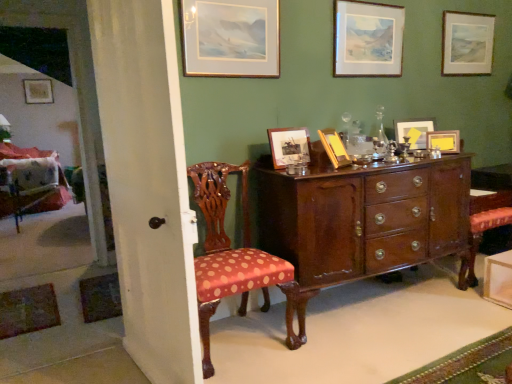
You are a GUI agent. You are given a task and a screenshot of the screen. Output one action in this format:
    pyautogui.click(x=<x>, y=<y>)
    Task: Click on the wooden picture frame at center, arranged as the seventh picture frame when viewed from the back
    The image size is (512, 384).
    Given the screenshot: What is the action you would take?
    pyautogui.click(x=334, y=148)

Measure the distance between point [336,136] and camera.

A distance of 2.44 meters exists between point [336,136] and camera.

Where is `polished wood cabinet at center`? This screenshot has width=512, height=384. polished wood cabinet at center is located at coordinates (362, 224).

What do you see at coordinates (38, 91) in the screenshot? Image resolution: width=512 pixels, height=384 pixels. I see `matte gold picture frame at upper left, the 1th picture frame positioned from the left` at bounding box center [38, 91].

This screenshot has height=384, width=512. In order to click on wooden picture frame at center, positioned as the 3th picture frame in front-to-back order in this screenshot , I will do `click(289, 146)`.

The height and width of the screenshot is (384, 512). I want to click on matte gold picture frame at upper center, acting as the 8th picture frame starting from the back, so click(x=230, y=38).

Image resolution: width=512 pixels, height=384 pixels. Describe the element at coordinates (230, 38) in the screenshot. I see `matte gold picture frame at upper center, positioned as the 2th picture frame in left-to-right order` at that location.

What do you see at coordinates (31, 182) in the screenshot?
I see `polka dot fabric chair at left, placed as the 1th chair when sorted from left to right` at bounding box center [31, 182].

In order to face polka dot fabric chair at left, which is the 2th chair in front-to-back order, should I rotate leftwards or rightwards?

Turn left approximately 27.982 degrees to face it.

The image size is (512, 384). I want to click on wooden picture frame at center, arranged as the fifth picture frame when viewed from the right, so [x=334, y=148].

Between matte gold picture frame at upper center, marked as the first picture frame in a front-to-back arrangement, and matte gold picture frame at upper left, which ranks as the 1th picture frame in back-to-front order, which one has more height?

With more height is matte gold picture frame at upper left, which ranks as the 1th picture frame in back-to-front order.

From a real-world perspective, which picture frame is the 3rd one underneath the matte gold picture frame at upper left, the 8th picture frame viewed from the right? Please provide its 2D coordinates.

[(230, 38)]

Are matte gold picture frame at upper center, the 7th picture frame in the right-to-left sequence, and matte gold picture frame at upper left, placed as the eighth picture frame when sorted from front to back, beside each other?

They are not placed beside each other.

Is matte gold picture frame at upper center, positioned as the 2th picture frame in left-to-right order, facing away from matte gold picture frame at upper left, placed as the eighth picture frame when sorted from front to back?

Yes, matte gold picture frame at upper center, positioned as the 2th picture frame in left-to-right order, is positioned with its back facing matte gold picture frame at upper left, placed as the eighth picture frame when sorted from front to back.

Is wooden picture frame at center, positioned as the 3th picture frame in front-to-back order, facing towards white painted wood door at left?

No.

From the image's perspective, is wooden picture frame at center, the sixth picture frame viewed from the right, positioned above or below white painted wood door at left?

wooden picture frame at center, the sixth picture frame viewed from the right, is situated higher than white painted wood door at left in the image.

Considering the positions of objects wooden picture frame at center, the sixth picture frame viewed from the right, and white painted wood door at left in the image provided, who is more to the left, wooden picture frame at center, the sixth picture frame viewed from the right, or white painted wood door at left?

white painted wood door at left.

Considering their positions, is wooden picture frame at center, acting as the 4th picture frame starting from the left, located in front of or behind white painted wood door at left?

Visually, wooden picture frame at center, acting as the 4th picture frame starting from the left, is located behind white painted wood door at left.

From a real-world perspective, does wooden picture frame at center, acting as the 4th picture frame starting from the left, stand above white painted wood door at left?

Yes, from a real-world perspective, wooden picture frame at center, acting as the 4th picture frame starting from the left, is above white painted wood door at left.

From the image's perspective, who appears lower, wooden picture frame at center, acting as the 4th picture frame starting from the left, or white painted wood door at left?

white painted wood door at left.

Considering the relative sizes of wooden picture frame at center, acting as the 4th picture frame starting from the left, and white painted wood door at left in the image provided, is wooden picture frame at center, acting as the 4th picture frame starting from the left, smaller than white painted wood door at left?

Indeed, wooden picture frame at center, acting as the 4th picture frame starting from the left, has a smaller size compared to white painted wood door at left.

Which of these two, matte gold picture frame at upper center, positioned as the 2th picture frame in left-to-right order, or matte wooden picture frame at upper right, the second picture frame when ordered from back to front, stands shorter?

matte gold picture frame at upper center, positioned as the 2th picture frame in left-to-right order, is shorter.

Does matte gold picture frame at upper center, acting as the 8th picture frame starting from the back, turn towards matte wooden picture frame at upper right, the second picture frame when ordered from back to front?

No, matte gold picture frame at upper center, acting as the 8th picture frame starting from the back, is not facing towards matte wooden picture frame at upper right, the second picture frame when ordered from back to front.

How different are the orientations of matte gold picture frame at upper center, acting as the 8th picture frame starting from the back, and matte wooden picture frame at upper right, the eighth picture frame when ordered from left to right, in degrees?

1.04 degrees.

From the image's perspective, which is above, matte gold picture frame at upper center, marked as the first picture frame in a front-to-back arrangement, or matte wooden picture frame at upper right, the eighth picture frame when ordered from left to right?

matte wooden picture frame at upper right, the eighth picture frame when ordered from left to right, appears higher in the image.

Based on their sizes in the image, would you say polka dot fabric chair at left, the first chair from the right, is bigger or smaller than wooden picture frame at center, acting as the 6th picture frame starting from the back?

Considering their sizes, polka dot fabric chair at left, the first chair from the right, takes up more space than wooden picture frame at center, acting as the 6th picture frame starting from the back.

Would you say polka dot fabric chair at left, which is the first chair from front to back, is to the left or to the right of wooden picture frame at center, positioned as the 3th picture frame in front-to-back order, in the picture?

In the image, polka dot fabric chair at left, which is the first chair from front to back, appears on the left side of wooden picture frame at center, positioned as the 3th picture frame in front-to-back order.

Can you tell me how much polka dot fabric chair at left, acting as the second chair starting from the back, and wooden picture frame at center, positioned as the 3th picture frame in front-to-back order, differ in facing direction?

The angular difference between polka dot fabric chair at left, acting as the second chair starting from the back, and wooden picture frame at center, positioned as the 3th picture frame in front-to-back order, is 3.98 degrees.

Considering the sizes of matte gold picture frame at upper left, the 8th picture frame viewed from the right, and yellow paper at upper right, which is the fourth picture frame from back to front, in the image, is matte gold picture frame at upper left, the 8th picture frame viewed from the right, taller or shorter than yellow paper at upper right, which is the fourth picture frame from back to front,?

matte gold picture frame at upper left, the 8th picture frame viewed from the right, is taller than yellow paper at upper right, which is the fourth picture frame from back to front.

Is matte gold picture frame at upper left, the 1th picture frame positioned from the left, facing away from yellow paper at upper right, the fifth picture frame in the front-to-back sequence?

No, matte gold picture frame at upper left, the 1th picture frame positioned from the left, is not facing away from yellow paper at upper right, the fifth picture frame in the front-to-back sequence.

From the image's perspective, is matte gold picture frame at upper left, placed as the eighth picture frame when sorted from front to back, positioned above or below yellow paper at upper right, the fifth picture frame in the front-to-back sequence?

matte gold picture frame at upper left, placed as the eighth picture frame when sorted from front to back, is above yellow paper at upper right, the fifth picture frame in the front-to-back sequence.

Is matte gold picture frame at upper left, the 1th picture frame positioned from the left, positioned behind yellow paper at upper right, the 7th picture frame from the left?

Yes, the depth of matte gold picture frame at upper left, the 1th picture frame positioned from the left, is greater than that of yellow paper at upper right, the 7th picture frame from the left.

Can you confirm if wooden picture frame at upper center, which is counted as the 5th picture frame, starting from the left, is bigger than matte yellow picture frame at upper right, which appears as the 3th picture frame when viewed from the back?

No, wooden picture frame at upper center, which is counted as the 5th picture frame, starting from the left, is not bigger than matte yellow picture frame at upper right, which appears as the 3th picture frame when viewed from the back.

Starting from the wooden picture frame at upper center, which is counted as the 5th picture frame, starting from the back, which picture frame is the 1st one to the right? Please provide its 2D coordinates.

[(414, 131)]

From the image's perspective, would you say wooden picture frame at upper center, the fourth picture frame when ordered from right to left, is shown under matte yellow picture frame at upper right, which ranks as the sixth picture frame in left-to-right order?

No, from the image's perspective, wooden picture frame at upper center, the fourth picture frame when ordered from right to left, is not below matte yellow picture frame at upper right, which ranks as the sixth picture frame in left-to-right order.

Visually, is wooden picture frame at upper center, the fourth picture frame when ordered from right to left, positioned to the left or to the right of matte yellow picture frame at upper right, which is counted as the 3th picture frame, starting from the right?

In the image, wooden picture frame at upper center, the fourth picture frame when ordered from right to left, appears on the left side of matte yellow picture frame at upper right, which is counted as the 3th picture frame, starting from the right.

At what (x,y) coordinates should I click in order to perform the action: click on picture frame that is the 1st one when counting rightward from the matte gold picture frame at upper left, the 1th picture frame positioned from the left. Please return your answer as a coordinate pair (x, y). The width and height of the screenshot is (512, 384). Looking at the image, I should click on [230, 38].

There is a white painted wood door at left. Where is `the 1st picture frame above it (from the image's perspective)`? This screenshot has width=512, height=384. the 1st picture frame above it (from the image's perspective) is located at coordinates (289, 146).

Based on their spatial positions, is wooden picture frame at center, which is the third picture frame in left-to-right order, or matte wooden picture frame at upper right, acting as the 1th picture frame starting from the right, further from yellow paper at upper right, the fifth picture frame in the front-to-back sequence?

The object further to yellow paper at upper right, the fifth picture frame in the front-to-back sequence, is wooden picture frame at center, which is the third picture frame in left-to-right order.

When comparing their distances from matte yellow picture frame at upper right, which is counted as the 3th picture frame, starting from the right, does wooden picture frame at center, which appears as the 2th picture frame when viewed from the front, or wooden picture frame at upper center, the fourth picture frame when ordered from right to left, seem closer?

The object closer to matte yellow picture frame at upper right, which is counted as the 3th picture frame, starting from the right, is wooden picture frame at upper center, the fourth picture frame when ordered from right to left.

From the image, which object appears to be nearer to matte gold picture frame at upper left, the 1th picture frame positioned from the left, polished wood cabinet at center or matte yellow picture frame at upper right, which appears as the 3th picture frame when viewed from the back?

matte yellow picture frame at upper right, which appears as the 3th picture frame when viewed from the back, is positioned closer to the anchor matte gold picture frame at upper left, the 1th picture frame positioned from the left.

Looking at this image, from the image, which object appears to be nearer to wooden picture frame at center, acting as the 4th picture frame starting from the left, polished wood cabinet at center or matte wooden picture frame at upper right, the second picture frame when ordered from back to front?

Among the two, polished wood cabinet at center is located nearer to wooden picture frame at center, acting as the 4th picture frame starting from the left.

Estimate the real-world distances between objects in this image. Which object is further from polka dot fabric chair at left, which is the 2th chair in front-to-back order, matte wooden picture frame at upper right, acting as the 1th picture frame starting from the right, or wooden picture frame at upper center, which is counted as the 4th picture frame, starting from the front?

matte wooden picture frame at upper right, acting as the 1th picture frame starting from the right, is positioned further to the anchor polka dot fabric chair at left, which is the 2th chair in front-to-back order.

When comparing their distances from white painted wood door at left, does polished wood cabinet at center or wooden picture frame at upper center, the fourth picture frame when ordered from right to left, seem further?

wooden picture frame at upper center, the fourth picture frame when ordered from right to left, is further to white painted wood door at left.

From the image, which object appears to be farther from matte gold picture frame at upper left, which ranks as the 1th picture frame in back-to-front order, white painted wood door at left or matte yellow picture frame at upper right, which ranks as the 6th picture frame in front-to-back order?

matte yellow picture frame at upper right, which ranks as the 6th picture frame in front-to-back order.

Based on their spatial positions, is matte gold picture frame at upper left, the 8th picture frame viewed from the right, or polka dot fabric chair at left, acting as the second chair starting from the back, closer to polka dot fabric chair at left, which is the 2th chair in front-to-back order?

Among the two, matte gold picture frame at upper left, the 8th picture frame viewed from the right, is located nearer to polka dot fabric chair at left, which is the 2th chair in front-to-back order.

Identify the location of door between polka dot fabric chair at left, which is the 2th chair in front-to-back order, and polished wood cabinet at center, in the horizontal direction. The width and height of the screenshot is (512, 384). (148, 184).

You are a GUI agent. You are given a task and a screenshot of the screen. Output one action in this format:
    pyautogui.click(x=<x>, y=<y>)
    Task: Click on the cabinetry situated between white painted wood door at left and yellow paper at upper right, the 7th picture frame from the left, from left to right
    
    Given the screenshot: What is the action you would take?
    pyautogui.click(x=362, y=224)

You are a GUI agent. You are given a task and a screenshot of the screen. Output one action in this format:
    pyautogui.click(x=<x>, y=<y>)
    Task: Click on the cabinetry between matte gold picture frame at upper center, positioned as the 2th picture frame in left-to-right order, and polka dot fabric chair at left, acting as the second chair starting from the back, in the up-down direction
    The height and width of the screenshot is (384, 512).
    Given the screenshot: What is the action you would take?
    pyautogui.click(x=362, y=224)

Identify the location of cabinetry located between polka dot fabric chair at left, the 2th chair viewed from the right, and matte wooden picture frame at upper right, acting as the 1th picture frame starting from the right, in the left-right direction. [x=362, y=224].